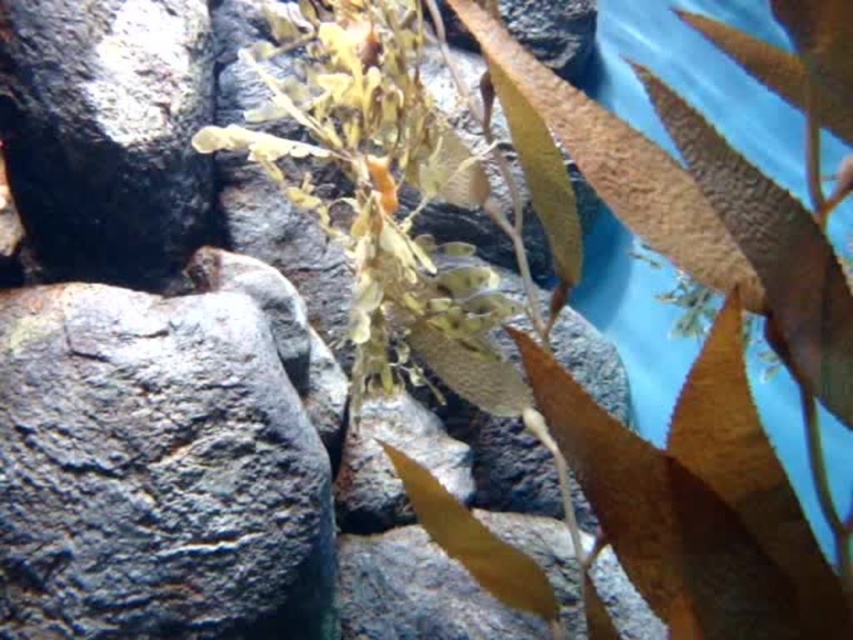
Question: Does gray rough rock at left have a smaller size compared to black matte rock at upper left?

Choices:
 (A) no
 (B) yes

Answer: (A)

Question: Which object appears farthest from the camera in this image?

Choices:
 (A) black matte rock at upper left
 (B) gray rough rock at left

Answer: (A)

Question: Can you confirm if gray rough rock at left is positioned to the right of black matte rock at upper left?

Choices:
 (A) no
 (B) yes

Answer: (B)

Question: Is gray rough rock at left in front of black matte rock at upper left?

Choices:
 (A) no
 (B) yes

Answer: (B)

Question: Which object is closer to the camera taking this photo?

Choices:
 (A) black matte rock at upper left
 (B) gray rough rock at left

Answer: (B)